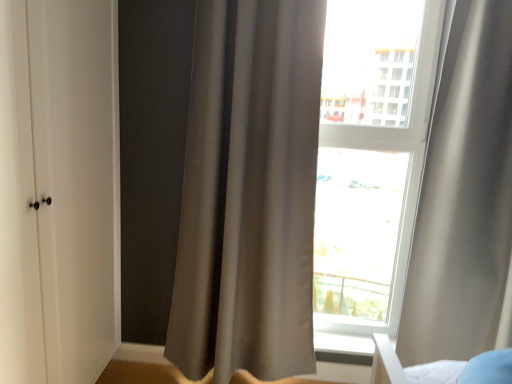
Question: From the image's perspective, is white matte cabinet at left located above or below matte gray curtain at center, which ranks as the 2th curtain in right-to-left order?

Choices:
 (A) below
 (B) above

Answer: (A)

Question: Considering the positions of point (62, 66) and point (196, 249), is point (62, 66) closer or farther from the camera than point (196, 249)?

Choices:
 (A) farther
 (B) closer

Answer: (B)

Question: Which object is positioned closest to the matte gray curtain at center, which ranks as the 2th curtain in right-to-left order?

Choices:
 (A) satin gray curtain at right, the first curtain viewed from the right
 (B) white matte cabinet at left
 (C) transparent glass window at center

Answer: (B)

Question: Considering the real-world distances, which object is closest to the white matte cabinet at left?

Choices:
 (A) matte gray curtain at center, which is the first curtain from left to right
 (B) transparent glass window at center
 (C) satin gray curtain at right, arranged as the second curtain when viewed from the left

Answer: (A)